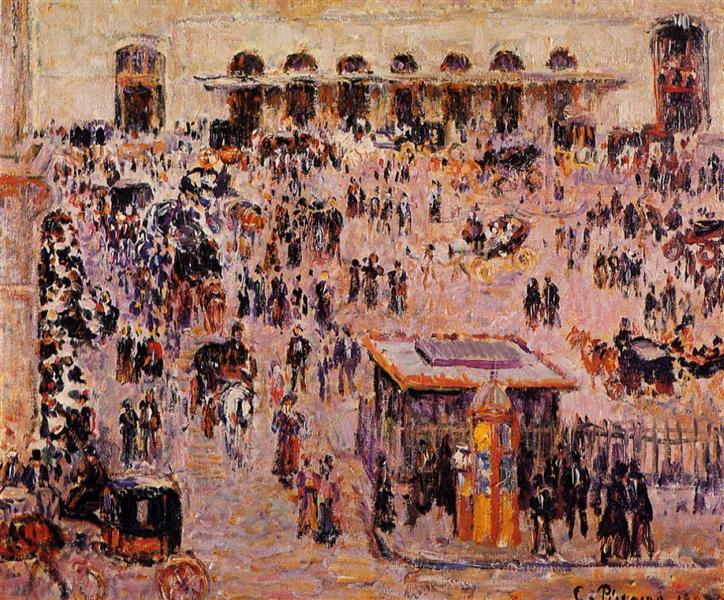
I want to click on painting, possibly from the impressionist period, so click(274, 548).